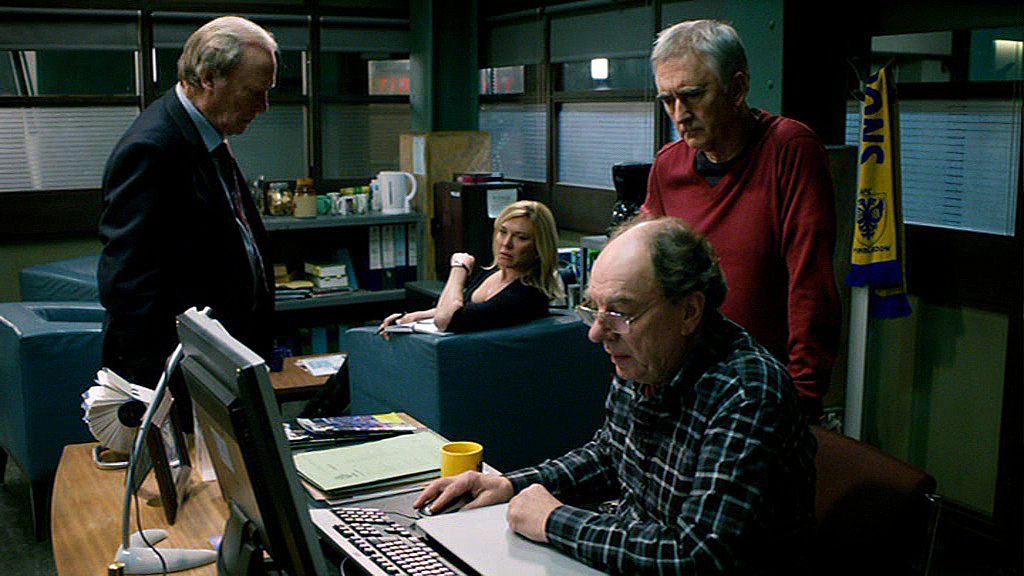
I want to click on shelf, so click(x=376, y=289).